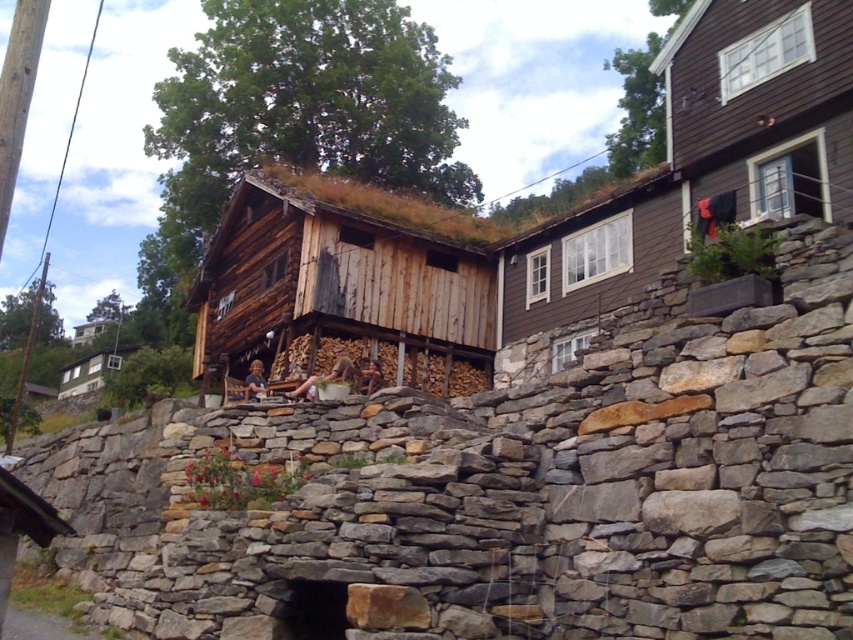
Question: Can you confirm if gray stone wall at center is positioned to the right of wooden cabin at lower left?

Choices:
 (A) no
 (B) yes

Answer: (B)

Question: Can you confirm if weathered wood hut at center is bigger than wooden cabin at lower left?

Choices:
 (A) yes
 (B) no

Answer: (A)

Question: Can you confirm if weathered wood hut at center is positioned above wooden cabin at lower left?

Choices:
 (A) yes
 (B) no

Answer: (A)

Question: Based on their relative distances, which object is farther from the wooden cabin at lower left?

Choices:
 (A) weathered wood hut at center
 (B) dark brown wooden hut at upper right
 (C) gray stone wall at center

Answer: (C)

Question: Which point appears closest to the camera in this image?

Choices:
 (A) (322, 560)
 (B) (809, 122)
 (C) (408, 360)

Answer: (A)

Question: Which object appears farthest from the camera in this image?

Choices:
 (A) gray stone wall at center
 (B) wooden cabin at lower left
 (C) dark brown wooden hut at upper right
 (D) weathered wood hut at center

Answer: (B)